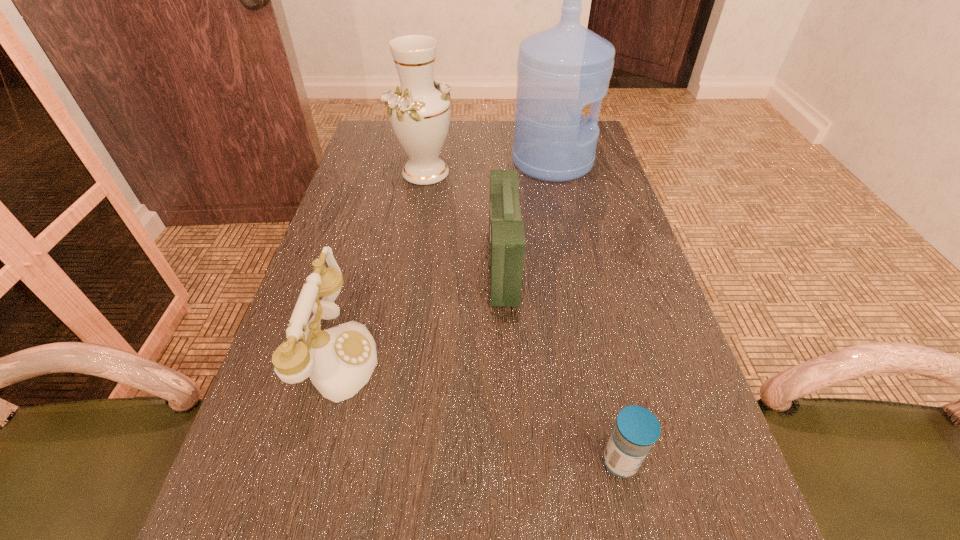
Find the location of a particular element. vacant position located on the dial of the telephone is located at coordinates (548, 355).

Locate an element on the screen. The image size is (960, 540). vacant space located 0.130m on the back of the nearest object is located at coordinates [601, 374].

Where is `water jug at the far edge`? water jug at the far edge is located at coordinates (561, 69).

This screenshot has width=960, height=540. What are the coordinates of `vase that is at the far edge` in the screenshot? It's located at (419, 111).

The width and height of the screenshot is (960, 540). Find the location of `vase that is at the left edge`. vase that is at the left edge is located at coordinates (419, 111).

Locate an element on the screen. This screenshot has width=960, height=540. telephone at the left edge is located at coordinates (340, 360).

Identify the location of water jug present at the right edge. Image resolution: width=960 pixels, height=540 pixels. (561, 69).

At what (x,y) coordinates should I click in order to perform the action: click on medicine present at the right edge. Please return your answer as a coordinate pair (x, y). This screenshot has width=960, height=540. Looking at the image, I should click on pyautogui.click(x=637, y=429).

Where is `object at the far left corner`? object at the far left corner is located at coordinates (419, 111).

The width and height of the screenshot is (960, 540). Find the location of `object that is at the far right corner`. object that is at the far right corner is located at coordinates (561, 69).